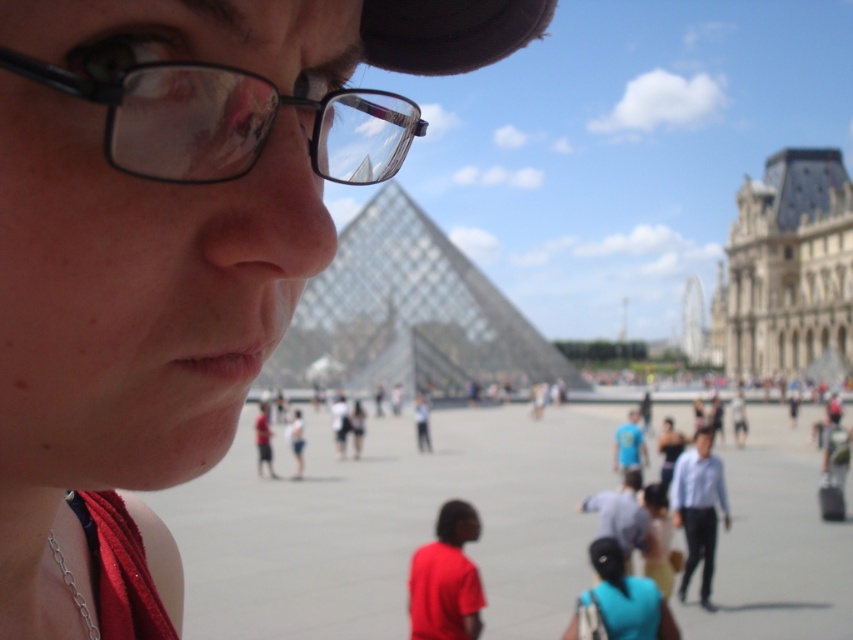
Who is positioned more to the left, matte black glasses at center or black plastic glasses at upper left?

matte black glasses at center is more to the left.

Can you confirm if matte black glasses at center is smaller than black plastic glasses at upper left?

Incorrect, matte black glasses at center is not smaller in size than black plastic glasses at upper left.

Is point (67, 216) more distant than point (221, 152)?

No, (67, 216) is in front of (221, 152).

Locate an element on the screen. The width and height of the screenshot is (853, 640). matte black glasses at center is located at coordinates (171, 253).